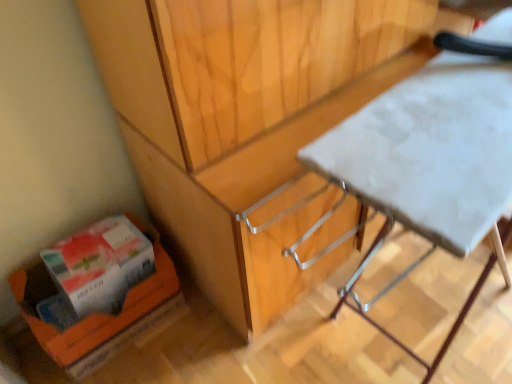
Question: From the image's perspective, would you say white fabric table at center is shown under orange cardboard box at lower left?

Choices:
 (A) yes
 (B) no

Answer: (B)

Question: From the image's perspective, is white fabric table at center on orange cardboard box at lower left?

Choices:
 (A) yes
 (B) no

Answer: (A)

Question: Considering the relative sizes of white fabric table at center and orange cardboard box at lower left in the image provided, is white fabric table at center taller than orange cardboard box at lower left?

Choices:
 (A) no
 (B) yes

Answer: (B)

Question: From a real-world perspective, does white fabric table at center stand above orange cardboard box at lower left?

Choices:
 (A) yes
 (B) no

Answer: (A)

Question: Is white fabric table at center positioned with its back to orange cardboard box at lower left?

Choices:
 (A) yes
 (B) no

Answer: (A)

Question: Is point (111, 236) positioned closer to the camera than point (415, 215)?

Choices:
 (A) farther
 (B) closer

Answer: (A)

Question: From a real-world perspective, relative to white fabric table at center, is orange cardboard box at lower left vertically above or below?

Choices:
 (A) below
 (B) above

Answer: (A)

Question: In terms of size, does orange cardboard box at lower left appear bigger or smaller than white fabric table at center?

Choices:
 (A) big
 (B) small

Answer: (B)

Question: Considering the positions of orange cardboard box at lower left and white fabric table at center in the image, is orange cardboard box at lower left taller or shorter than white fabric table at center?

Choices:
 (A) short
 (B) tall

Answer: (A)

Question: In terms of width, does white fabric table at center look wider or thinner when compared to orange cardboard box at lower left?

Choices:
 (A) thin
 (B) wide

Answer: (B)

Question: Considering their positions, is white fabric table at center located in front of or behind orange cardboard box at lower left?

Choices:
 (A) behind
 (B) front

Answer: (B)

Question: From a real-world perspective, is white fabric table at center physically located above or below orange cardboard box at lower left?

Choices:
 (A) above
 (B) below

Answer: (A)

Question: Is white fabric table at center inside or outside of orange cardboard box at lower left?

Choices:
 (A) outside
 (B) inside

Answer: (A)

Question: Considering the positions of orange cardboard box at lower left and orange cardboard box at lower left in the image, is orange cardboard box at lower left taller or shorter than orange cardboard box at lower left?

Choices:
 (A) tall
 (B) short

Answer: (B)

Question: From the image's perspective, is orange cardboard box at lower left located above or below orange cardboard box at lower left?

Choices:
 (A) below
 (B) above

Answer: (B)